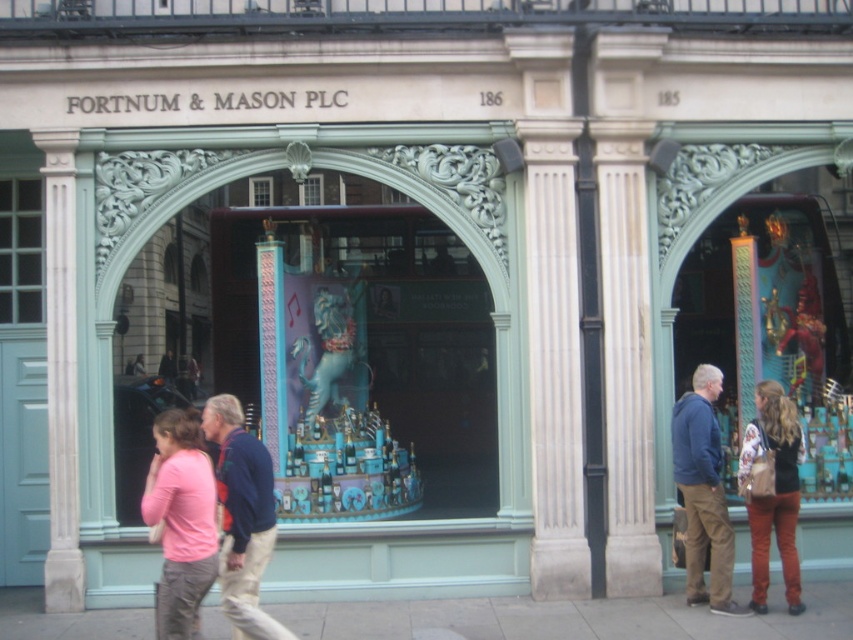
Question: Estimate the real-world distances between objects in this image. Which object is farther from the blue cotton jacket at center?

Choices:
 (A) floral-patterned fabric at center
 (B) pink fabric shirt at lower left

Answer: (A)

Question: Is white marble column at left smaller than blue fleece jacket at center?

Choices:
 (A) no
 (B) yes

Answer: (B)

Question: Does blue cotton jacket at center appear over blue fleece jacket at center?

Choices:
 (A) no
 (B) yes

Answer: (B)

Question: Which is nearer to the pink fabric shirt at lower left?

Choices:
 (A) shiny blue statue at center
 (B) smooth concrete sidewalk at lower center

Answer: (B)

Question: Which is farther from the floral-patterned fabric at center?

Choices:
 (A) blue cotton jacket at center
 (B) smooth concrete sidewalk at lower center
 (C) pink fabric shirt at lower left

Answer: (C)

Question: Is shiny blue statue at center below blue fleece jacket at center?

Choices:
 (A) yes
 (B) no

Answer: (B)